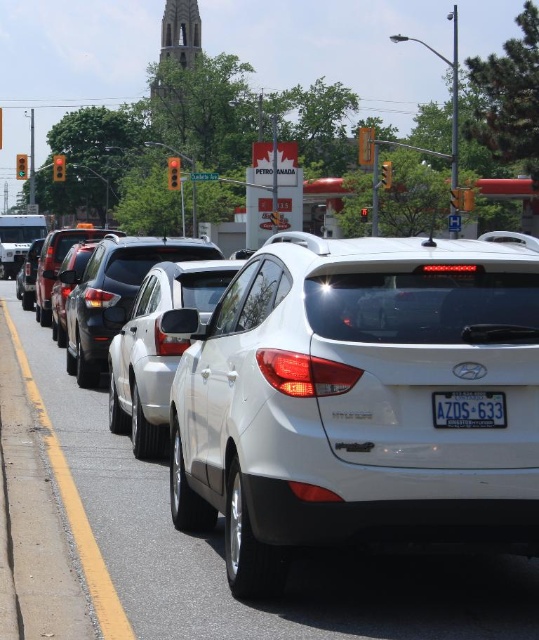
Is white plastic license plate at center to the left of orange matte traffic light at upper center from the viewer's perspective?

Incorrect, white plastic license plate at center is not on the left side of orange matte traffic light at upper center.

Is white plastic license plate at center taller than orange matte traffic light at upper center?

In fact, white plastic license plate at center may be shorter than orange matte traffic light at upper center.

Does point (440, 417) lie in front of point (175, 179)?

Yes, it is in front of point (175, 179).

At what (x,y) coordinates should I click in order to perform the action: click on white plastic license plate at center. Please return your answer as a coordinate pair (x, y). Image resolution: width=539 pixels, height=640 pixels. Looking at the image, I should click on (468, 410).

Is shiny black sedan at center to the right of green glass traffic light at upper left from the viewer's perspective?

Correct, you'll find shiny black sedan at center to the right of green glass traffic light at upper left.

Does shiny black sedan at center appear on the left side of green glass traffic light at upper left?

No, shiny black sedan at center is not to the left of green glass traffic light at upper left.

Does point (81, 380) come behind point (1, 140)?

No, it is not.

Where is `shiny black sedan at center`? Image resolution: width=539 pixels, height=640 pixels. shiny black sedan at center is located at coordinates (114, 294).

Looking at this image, does orange matte traffic light at upper center have a greater width compared to red glass traffic light at center?

Indeed, orange matte traffic light at upper center has a greater width compared to red glass traffic light at center.

Where is `orange matte traffic light at upper center`? orange matte traffic light at upper center is located at coordinates (174, 173).

Looking at this image, who is more distant from viewer, (172, 184) or (367, 208)?

Point (172, 184)

Identify the location of orange matte traffic light at upper center. (174, 173).